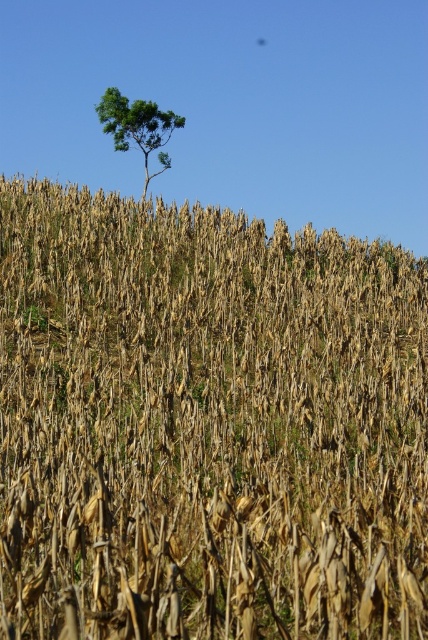
Between point (250, 349) and point (145, 109), which one is positioned behind?

Positioned behind is point (145, 109).

Measure the distance between brown dry stalks of corn at center and green leafy tree at upper center.

The distance of brown dry stalks of corn at center from green leafy tree at upper center is 38.89 feet.

The image size is (428, 640). Describe the element at coordinates (207, 424) in the screenshot. I see `brown dry stalks of corn at center` at that location.

Where is `brown dry stalks of corn at center`? The image size is (428, 640). brown dry stalks of corn at center is located at coordinates (207, 424).